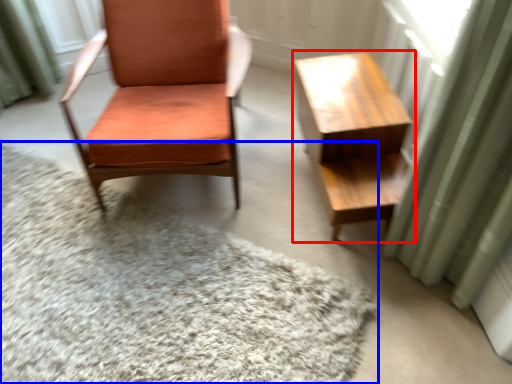
Question: Which object appears farthest to the camera in this image, table (highlighted by a red box) or mat (highlighted by a blue box)?

Choices:
 (A) table
 (B) mat

Answer: (A)